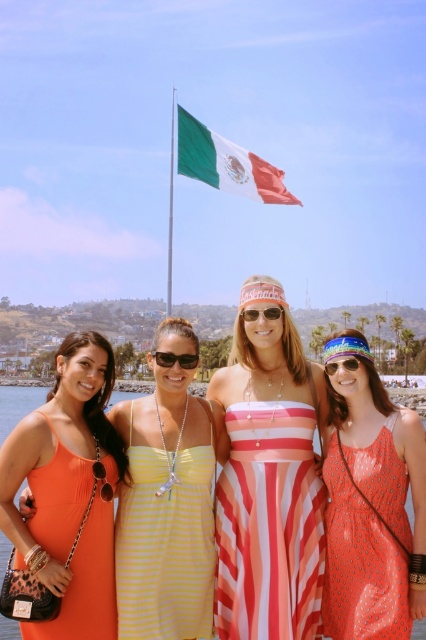
You are a photographer trying to capture a clear shot of both the matte orange dress at lower left and the orange ribbed dress at lower left. Since they are positioned close to each other, will you need to adjust your camera focus to ensure both are in focus?

The orange ribbed dress at lower left is behind the matte orange dress at lower left, so adjusting the focus might be necessary to ensure both are in focus.

You are a photographer planning to capture a group shot of the women in the scene. You need to ensure that the green and white striped fabric at upper center and the green metallic flag pole at upper center do not block the view of the women. Based on their widths, which object might be more likely to obstruct the view?

The green and white striped fabric at upper center might be wider than the green metallic flag pole at upper center, so it could potentially block the view more than the flag pole.

In the scene shown: You are a photographer trying to capture the orange fabric dress at lower left and the clear plastic sunglasses at center. Based on their positions, which object is closer to the bottom edge of the photo?

The orange fabric dress at lower left is closer to the bottom edge of the photo because it is located below the clear plastic sunglasses at center.